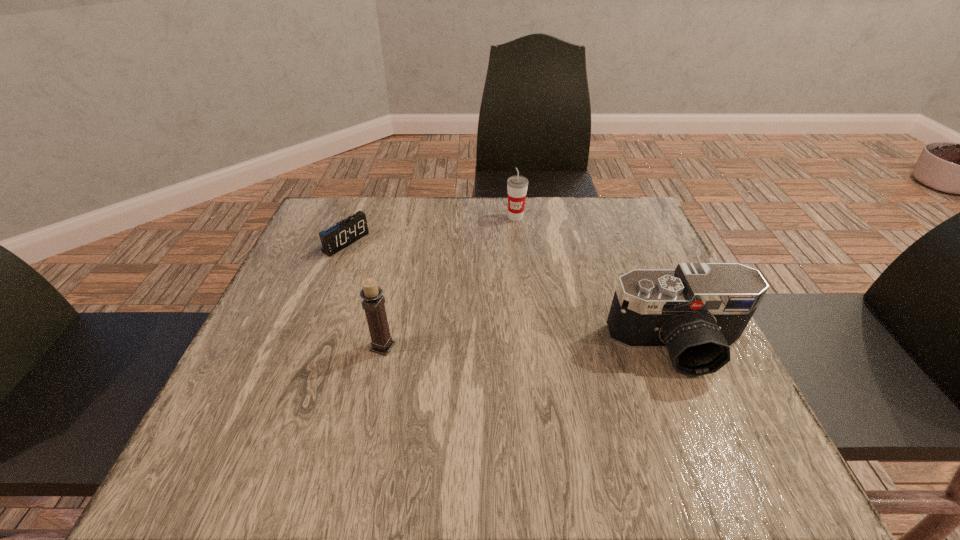
Identify the location of vacant area situated 0.080m on the front-facing side of the leftmost object. [x=381, y=264].

Locate an element on the screen. The width and height of the screenshot is (960, 540). blank space located 0.340m on the side of the third object from left to right with the logo is located at coordinates click(536, 314).

I want to click on free spot located 0.190m on the side of the third object from left to right with the logo, so click(526, 268).

I want to click on vacant point located on the side of the third object from left to right with the logo, so click(x=528, y=280).

At what (x,y) coordinates should I click in order to perform the action: click on alarm clock located at the far edge. Please return your answer as a coordinate pair (x, y). Image resolution: width=960 pixels, height=540 pixels. Looking at the image, I should click on (335, 238).

Image resolution: width=960 pixels, height=540 pixels. I want to click on cup that is at the far edge, so click(517, 186).

In order to click on object that is at the left edge in this screenshot , I will do `click(335, 238)`.

Identify the location of object that is at the right edge. The image size is (960, 540). click(698, 311).

Where is `object located at the far left corner`? object located at the far left corner is located at coordinates (335, 238).

This screenshot has height=540, width=960. I want to click on free region at the far edge of the desktop, so click(539, 217).